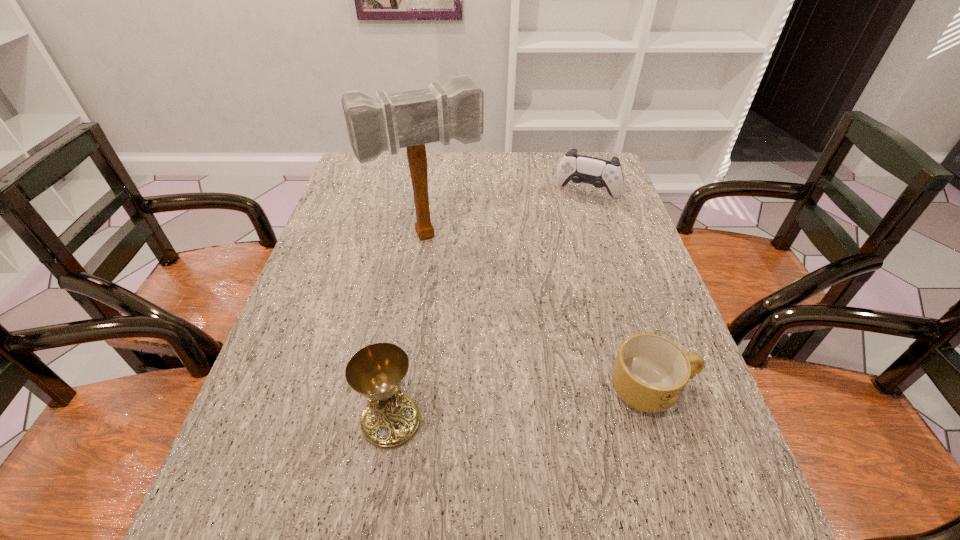
Locate an element on the screen. the third shortest object is located at coordinates (391, 419).

In order to click on the shortest object in this screenshot , I will do `click(650, 372)`.

Find the location of a particular element. Image resolution: width=960 pixels, height=540 pixels. the farthest object is located at coordinates (600, 173).

The width and height of the screenshot is (960, 540). Find the location of `control`. control is located at coordinates click(x=600, y=173).

Identify the location of the tallest object. (411, 119).

The height and width of the screenshot is (540, 960). I want to click on the third nearest object, so click(411, 119).

Where is `vacant space located on the left of the chalice`? Image resolution: width=960 pixels, height=540 pixels. vacant space located on the left of the chalice is located at coordinates (273, 422).

In order to click on free space located 0.090m on the front-facing side of the farthest object in this screenshot , I will do `click(571, 221)`.

Locate an element on the screen. This screenshot has height=540, width=960. free space located on the front-facing side of the farthest object is located at coordinates tap(562, 243).

Where is `free space located on the front-facing side of the farthest object`? Image resolution: width=960 pixels, height=540 pixels. free space located on the front-facing side of the farthest object is located at coordinates (565, 233).